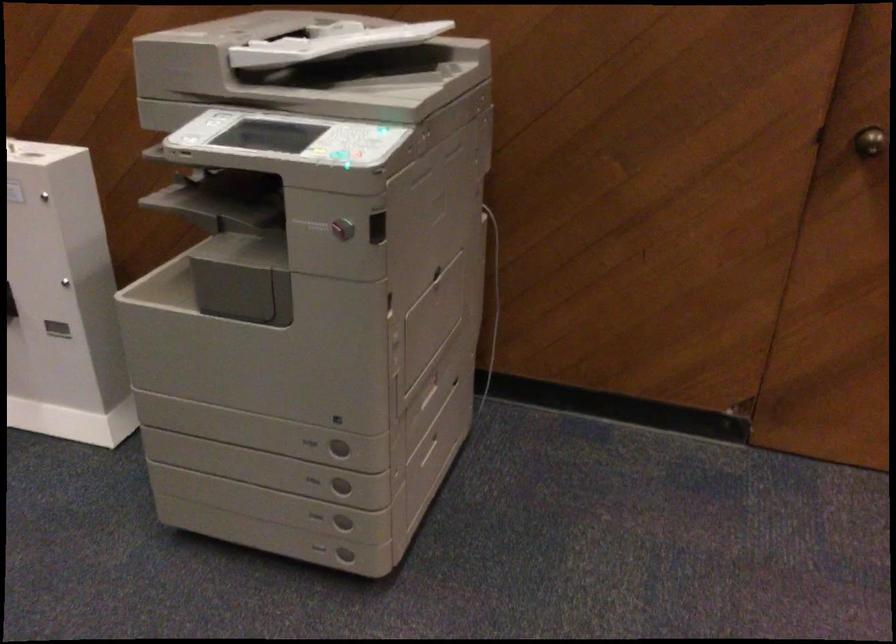
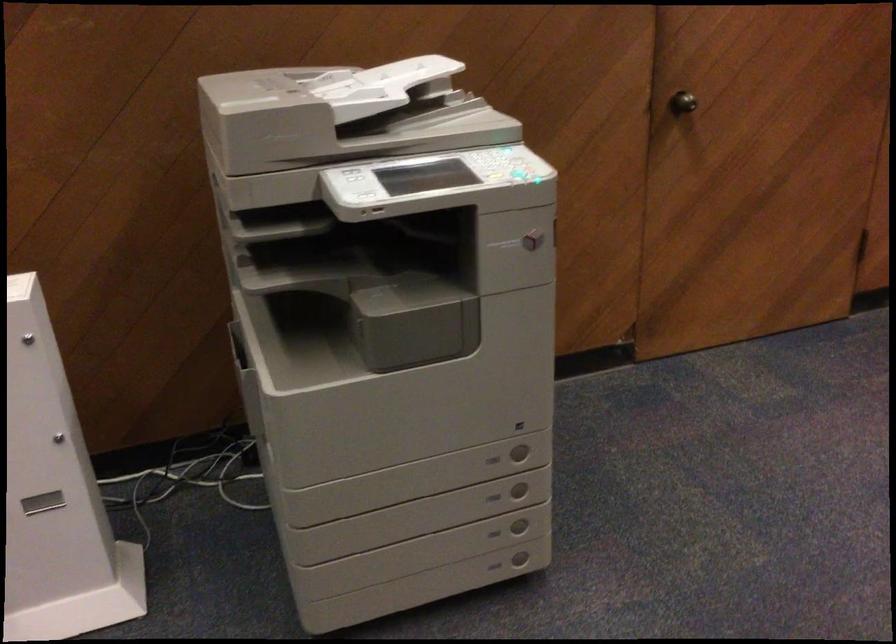
The point at (313,484) is marked in the first image. Where is the corresponding point in the second image?

(493, 497)